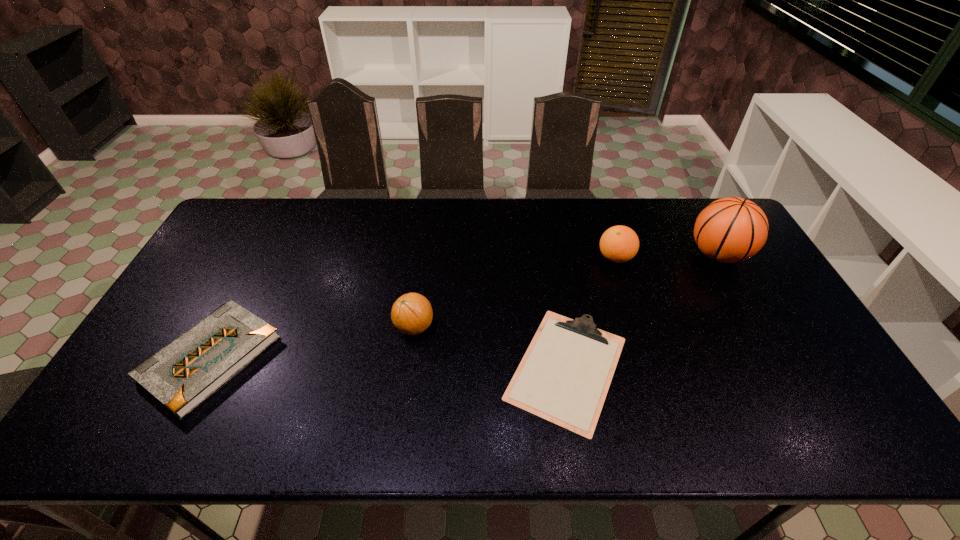
Identify the location of basketball. Image resolution: width=960 pixels, height=540 pixels. (729, 230).

Where is `the rightmost object`? the rightmost object is located at coordinates (729, 230).

At what (x,y) coordinates should I click in order to perform the action: click on the right orange. Please return your answer as a coordinate pair (x, y). This screenshot has width=960, height=540. Looking at the image, I should click on (619, 244).

Identify the location of the left orange. (411, 314).

Identify the location of the second object from left to right. (x=411, y=314).

The height and width of the screenshot is (540, 960). Find the location of `the leftmost object`. the leftmost object is located at coordinates coord(185,373).

Locate an element on the screen. the fourth tallest object is located at coordinates (185, 373).

Find the location of a particular element. the shortest object is located at coordinates (564, 376).

Locate an element on the screen. The width and height of the screenshot is (960, 540). free space located 0.070m on the front of the rightmost object is located at coordinates (740, 293).

Where is `vacant area situated on the left of the farther orange`? This screenshot has width=960, height=540. vacant area situated on the left of the farther orange is located at coordinates [560, 258].